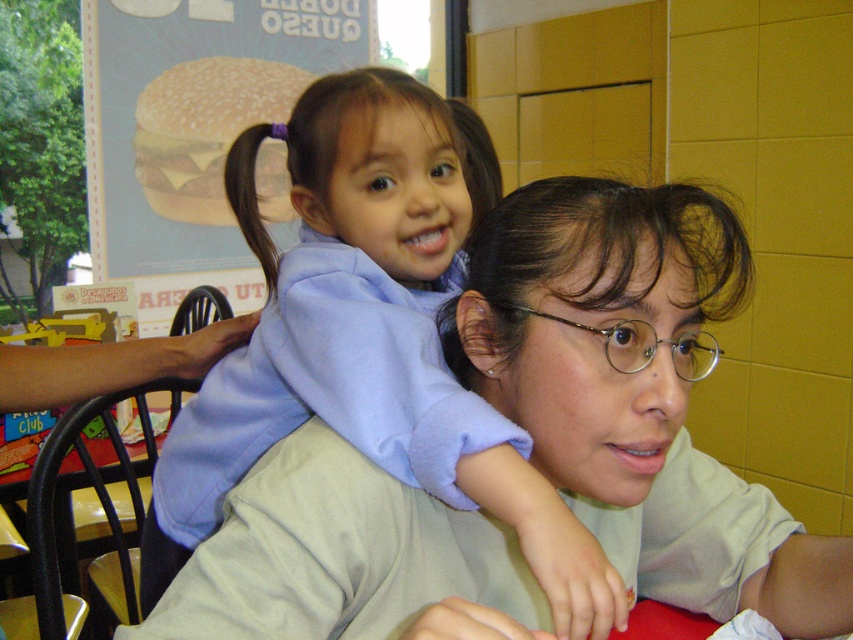
Does light blue fleece at center have a larger size compared to metallic round glasses at center?

Correct, light blue fleece at center is larger in size than metallic round glasses at center.

Who is more forward, (430, 99) or (608, 356)?

Positioned in front is point (608, 356).

Describe the element at coordinates (373, 348) in the screenshot. I see `light blue fleece at center` at that location.

What are the coordinates of `light blue fleece at center` in the screenshot? It's located at (373, 348).

Who is lower down, light blue fleece at center or dark brown silky hair at upper center?

Positioned lower is light blue fleece at center.

Is light blue fleece at center to the left of dark brown silky hair at upper center from the viewer's perspective?

No, light blue fleece at center is not to the left of dark brown silky hair at upper center.

Find the location of `light blue fleece at center`. light blue fleece at center is located at coordinates point(373,348).

Between metallic round glasses at center and dark brown silky hair at upper center, which one is positioned higher?

Positioned higher is dark brown silky hair at upper center.

Between point (712, 342) and point (252, 218), which one is positioned in front?

Positioned in front is point (252, 218).

Is point (634, 356) farther from camera compared to point (268, 129)?

No, (634, 356) is in front of (268, 129).

This screenshot has height=640, width=853. I want to click on metallic round glasses at center, so click(x=643, y=344).